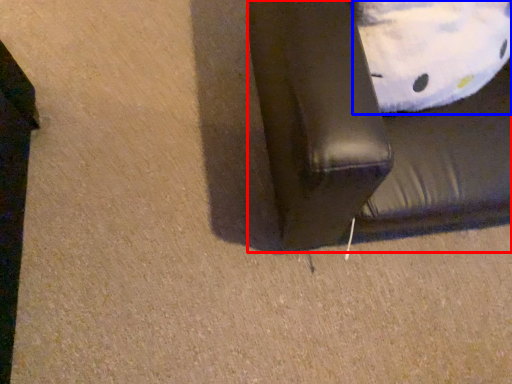
Question: Among these objects, which one is farthest to the camera, furniture (highlighted by a red box) or pillow (highlighted by a blue box)?

Choices:
 (A) furniture
 (B) pillow

Answer: (B)